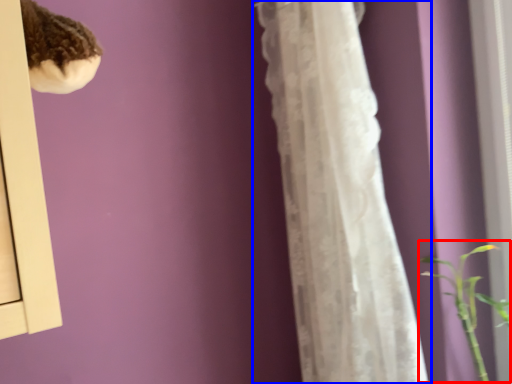
Question: Among these objects, which one is nearest to the camera, orchid (highlighted by a red box) or curtain (highlighted by a blue box)?

Choices:
 (A) orchid
 (B) curtain

Answer: (B)